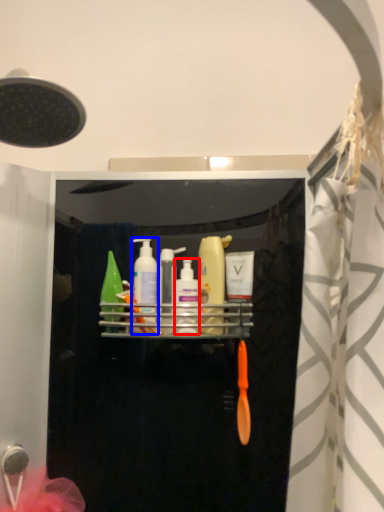
Question: Which point is further to the camera, mouthwash (highlighted by a red box) or mouthwash (highlighted by a blue box)?

Choices:
 (A) mouthwash
 (B) mouthwash

Answer: (B)